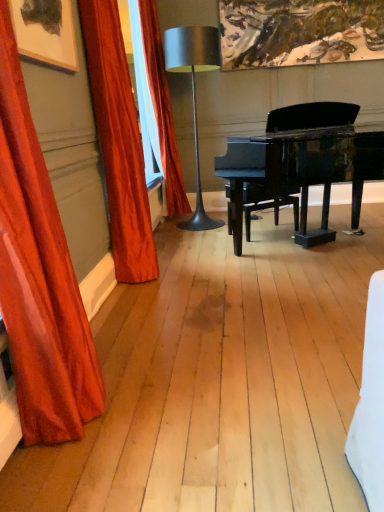
Where is `vacant area located to the right-hand side of satin red curtain at left, arranged as the second curtain when viewed from the back`? vacant area located to the right-hand side of satin red curtain at left, arranged as the second curtain when viewed from the back is located at coordinates click(x=187, y=271).